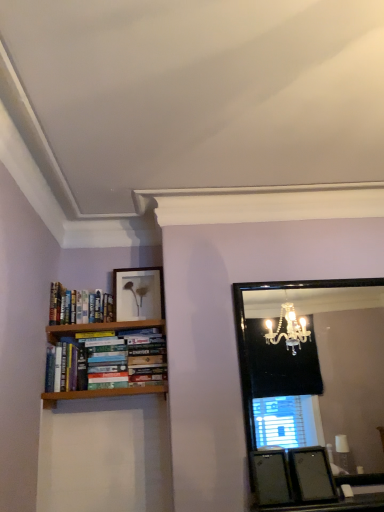
Describe the element at coordinates (310, 385) in the screenshot. The image size is (384, 512). I see `black glass mirror at upper right` at that location.

From the picture: In order to face matte white picture frame at upper center, arranged as the 1th picture frame when viewed from the top, should I rotate leftwards or rightwards?

A 7.020 degree turn to the left will do.

What is the approximate height of matte white picture frame at upper center, arranged as the 1th picture frame when viewed from the top?

The height of matte white picture frame at upper center, arranged as the 1th picture frame when viewed from the top, is 10.85 inches.

You are a GUI agent. You are given a task and a screenshot of the screen. Output one action in this format:
    pyautogui.click(x=<x>, y=<y>)
    Task: Click on the hardcover books at left
    
    Given the screenshot: What is the action you would take?
    coord(79,306)

Where is `matte black picture frame at lower right, the first picture frame in the front-to-back sequence`? This screenshot has height=512, width=384. matte black picture frame at lower right, the first picture frame in the front-to-back sequence is located at coordinates (311, 475).

Locate an element on the screen. The height and width of the screenshot is (512, 384). black glass mirror at upper right is located at coordinates (310, 385).

In the scene shown: Does black glass mirror at upper right turn towards hardcover books at left?

No, black glass mirror at upper right does not turn towards hardcover books at left.

Considering the sizes of objects black glass mirror at upper right and hardcover books at left in the image provided, who is smaller, black glass mirror at upper right or hardcover books at left?

Smaller between the two is hardcover books at left.

Looking at this image, looking at their sizes, would you say black glass mirror at upper right is wider or thinner than hardcover books at left?

black glass mirror at upper right is thinner than hardcover books at left.

Between point (380, 295) and point (99, 309), which one is positioned in front?

Positioned in front is point (99, 309).

Considering the sizes of objects matte black picture frame at lower right, the second picture frame positioned from the back, and matte white picture frame at upper center, which appears as the first picture frame when viewed from the left, in the image provided, who is thinner, matte black picture frame at lower right, the second picture frame positioned from the back, or matte white picture frame at upper center, which appears as the first picture frame when viewed from the left,?

matte white picture frame at upper center, which appears as the first picture frame when viewed from the left, is thinner.

In terms of size, does matte black picture frame at lower right, placed as the 1th picture frame when sorted from right to left, appear bigger or smaller than matte white picture frame at upper center, which appears as the first picture frame when viewed from the left?

matte black picture frame at lower right, placed as the 1th picture frame when sorted from right to left, is bigger than matte white picture frame at upper center, which appears as the first picture frame when viewed from the left.

Is matte black picture frame at lower right, the second picture frame positioned from the back, inside the boundaries of matte white picture frame at upper center, which ranks as the 2th picture frame in right-to-left order, or outside?

matte black picture frame at lower right, the second picture frame positioned from the back, is not inside matte white picture frame at upper center, which ranks as the 2th picture frame in right-to-left order, it's outside.

From the image's perspective, which one is positioned lower, matte black picture frame at lower right, the first picture frame in the front-to-back sequence, or matte white picture frame at upper center, which is the first picture frame in back-to-front order?

matte black picture frame at lower right, the first picture frame in the front-to-back sequence, appears lower in the image.

Based on their positions, is matte black picture frame at lower right, the second picture frame positioned from the back, located to the left or right of black glass mirror at upper right?

From the image, it's evident that matte black picture frame at lower right, the second picture frame positioned from the back, is to the left of black glass mirror at upper right.

Looking at the image, does matte black picture frame at lower right, placed as the 1th picture frame when sorted from right to left, seem bigger or smaller compared to black glass mirror at upper right?

matte black picture frame at lower right, placed as the 1th picture frame when sorted from right to left, is smaller than black glass mirror at upper right.

Is point (332, 477) positioned in front of point (354, 400)?

That is True.

In the image, is matte white picture frame at upper center, the 2th picture frame from the bottom, positioned in front of or behind black glass mirror at upper right?

matte white picture frame at upper center, the 2th picture frame from the bottom, is behind black glass mirror at upper right.

Could you tell me if matte white picture frame at upper center, the 2th picture frame from the bottom, is turned towards black glass mirror at upper right?

No, matte white picture frame at upper center, the 2th picture frame from the bottom, is not oriented towards black glass mirror at upper right.

This screenshot has height=512, width=384. I want to click on mirror below the matte white picture frame at upper center, positioned as the 2th picture frame in front-to-back order (from the image's perspective), so click(310, 385).

Would you say hardcover books at left is part of matte black picture frame at lower right, the 1th picture frame ordered from the bottom,'s contents?

No, hardcover books at left is not surrounded by matte black picture frame at lower right, the 1th picture frame ordered from the bottom.

The image size is (384, 512). What are the coordinates of `book behind the matte black picture frame at lower right, the first picture frame in the front-to-back sequence` in the screenshot? It's located at (79, 306).

Measure the distance from matte black picture frame at lower right, placed as the 1th picture frame when sorted from right to left, to hardcover books at left.

matte black picture frame at lower right, placed as the 1th picture frame when sorted from right to left, and hardcover books at left are 1.24 meters apart.

Is matte white picture frame at upper center, the 2th picture frame from the bottom, placed right next to hardcover books at left?

matte white picture frame at upper center, the 2th picture frame from the bottom, is not next to hardcover books at left, and they're not touching.

Which is behind, matte white picture frame at upper center, positioned as the 2th picture frame in front-to-back order, or hardcover books at left?

matte white picture frame at upper center, positioned as the 2th picture frame in front-to-back order.

Which of these two, matte white picture frame at upper center, positioned as the 2th picture frame in front-to-back order, or hardcover books at left, is smaller?

Smaller between the two is matte white picture frame at upper center, positioned as the 2th picture frame in front-to-back order.

Is matte white picture frame at upper center, positioned as the 2th picture frame in front-to-back order, inside the boundaries of hardcover books at left, or outside?

matte white picture frame at upper center, positioned as the 2th picture frame in front-to-back order, lies outside hardcover books at left.

From the image's perspective, does hardcover books at left appear lower than matte black picture frame at lower right, the first picture frame in the front-to-back sequence?

No, from the image's perspective, hardcover books at left is not beneath matte black picture frame at lower right, the first picture frame in the front-to-back sequence.

From a real-world perspective, is hardcover books at left beneath matte black picture frame at lower right, which is counted as the 2th picture frame, starting from the top?

No, from a real-world perspective, hardcover books at left is not below matte black picture frame at lower right, which is counted as the 2th picture frame, starting from the top.

Does hardcover books at left have a lesser height compared to matte black picture frame at lower right, which is counted as the 2th picture frame, starting from the top?

In fact, hardcover books at left may be taller than matte black picture frame at lower right, which is counted as the 2th picture frame, starting from the top.

From the picture: Can you tell me how much hardcover books at left and matte black picture frame at lower right, the second picture frame in the left-to-right sequence, differ in facing direction?

The angular difference between hardcover books at left and matte black picture frame at lower right, the second picture frame in the left-to-right sequence, is 3.32 degrees.

Find the location of `book above the black glass mirror at upper right (from the image's perspective)`. book above the black glass mirror at upper right (from the image's perspective) is located at coordinates (79, 306).

The image size is (384, 512). Find the location of `picture frame below the matte white picture frame at upper center, arranged as the 1th picture frame when viewed from the top (from a real-world perspective)`. picture frame below the matte white picture frame at upper center, arranged as the 1th picture frame when viewed from the top (from a real-world perspective) is located at coordinates pos(311,475).

Which object lies further to the anchor point black glass mirror at upper right, matte black picture frame at lower right, the second picture frame positioned from the back, or hardcover books at left?

Among the two, matte black picture frame at lower right, the second picture frame positioned from the back, is located further to black glass mirror at upper right.

From the picture: From the image, which object appears to be farther from black glass mirror at upper right, hardcover books at left or matte black picture frame at lower right, the first picture frame in the front-to-back sequence?

matte black picture frame at lower right, the first picture frame in the front-to-back sequence.

Looking at the image, which one is located further to hardcover books at left, matte black picture frame at lower right, the 1th picture frame ordered from the bottom, or matte white picture frame at upper center, which appears as the first picture frame when viewed from the left?

matte black picture frame at lower right, the 1th picture frame ordered from the bottom, is further to hardcover books at left.

Consider the image. Based on their spatial positions, is matte white picture frame at upper center, which ranks as the 2th picture frame in right-to-left order, or matte black picture frame at lower right, the first picture frame in the front-to-back sequence, further from hardcover books at left?

matte black picture frame at lower right, the first picture frame in the front-to-back sequence, is further to hardcover books at left.

Based on their spatial positions, is black glass mirror at upper right or matte black picture frame at lower right, the second picture frame positioned from the back, further from hardcover books at left?

black glass mirror at upper right is further to hardcover books at left.

Considering their positions, is matte black picture frame at lower right, which is counted as the 2th picture frame, starting from the top, positioned closer to matte white picture frame at upper center, arranged as the 1th picture frame when viewed from the top, than hardcover books at left?

Among the two, hardcover books at left is located nearer to matte white picture frame at upper center, arranged as the 1th picture frame when viewed from the top.

When comparing their distances from black glass mirror at upper right, does matte white picture frame at upper center, positioned as the 2th picture frame in front-to-back order, or hardcover books at left seem further?

hardcover books at left.

From the image, which object appears to be nearer to matte black picture frame at lower right, the second picture frame in the left-to-right sequence, matte white picture frame at upper center, which is the first picture frame in back-to-front order, or black glass mirror at upper right?

matte white picture frame at upper center, which is the first picture frame in back-to-front order, is positioned closer to the anchor matte black picture frame at lower right, the second picture frame in the left-to-right sequence.

You are a GUI agent. You are given a task and a screenshot of the screen. Output one action in this format:
    pyautogui.click(x=<x>, y=<y>)
    Task: Click on the picture frame located between hardcover books at left and matte black picture frame at lower right, the second picture frame in the left-to-right sequence, in the left-right direction
    This screenshot has height=512, width=384.
    Given the screenshot: What is the action you would take?
    pyautogui.click(x=138, y=293)

Find the location of a particular element. Image resolution: width=384 pixels, height=512 pixels. picture frame between matte white picture frame at upper center, which is the first picture frame in back-to-front order, and black glass mirror at upper right, in the horizontal direction is located at coordinates (311, 475).